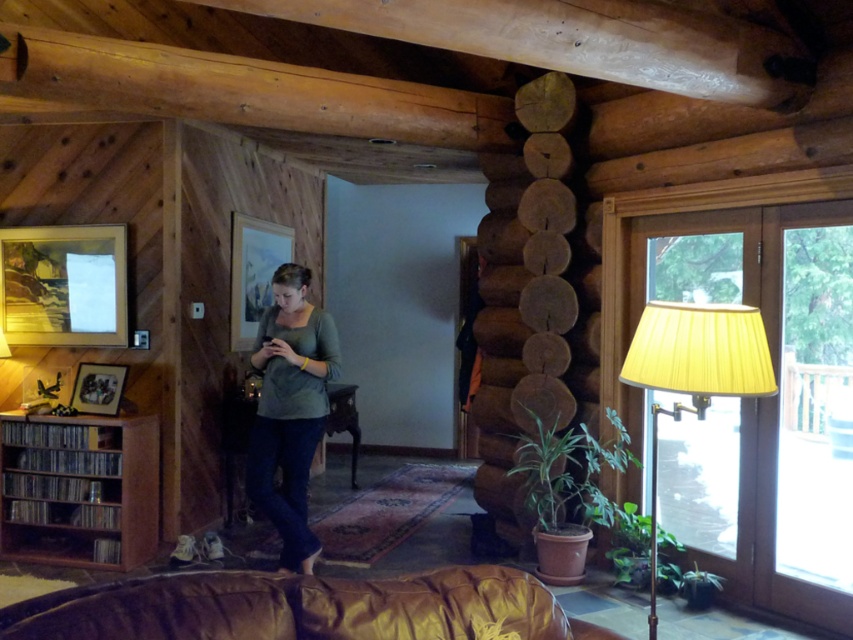
Question: Which point is farther to the camera?

Choices:
 (A) (296, 324)
 (B) (636, 356)

Answer: (A)

Question: Which of these objects is positioned closest to the brown leather couch at lower center?

Choices:
 (A) yellow pleated shade at right
 (B) brown wooden bookshelf at lower left

Answer: (A)

Question: Can you confirm if brown wooden bookshelf at lower left is positioned to the right of yellow pleated shade at right?

Choices:
 (A) yes
 (B) no

Answer: (B)

Question: Is brown wooden bookshelf at lower left above green matte shirt at center?

Choices:
 (A) no
 (B) yes

Answer: (A)

Question: Which point is farther to the camera?

Choices:
 (A) yellow pleated shade at right
 (B) brown wooden bookshelf at lower left

Answer: (B)

Question: Can you confirm if brown wooden bookshelf at lower left is wider than yellow pleated shade at right?

Choices:
 (A) yes
 (B) no

Answer: (A)